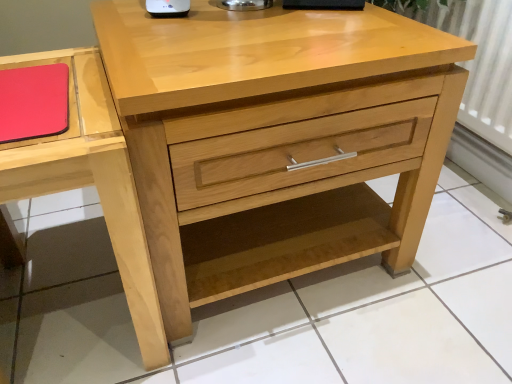
Find the location of a particular element. The height and width of the screenshot is (384, 512). empty space that is ontop of matte wood vanity at left (from a real-world perspective) is located at coordinates (37, 89).